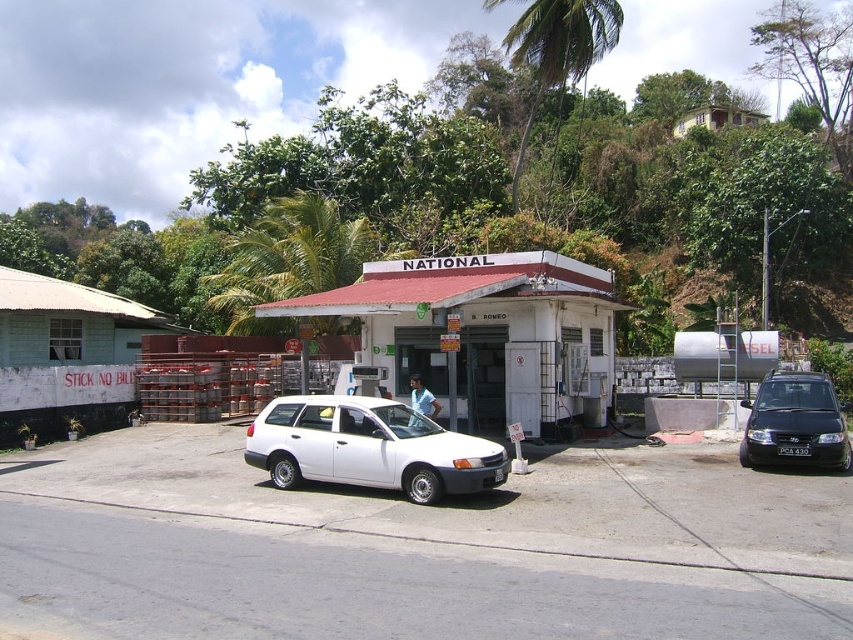
Does white matte wagon at center appear on the left side of black matte van at right?

Yes, white matte wagon at center is to the left of black matte van at right.

Can you confirm if white matte wagon at center is taller than black matte van at right?

In fact, white matte wagon at center may be shorter than black matte van at right.

Between point (447, 493) and point (831, 449), which one is positioned behind?

The point (831, 449) is more distant.

This screenshot has height=640, width=853. Find the location of `white matte wagon at center`. white matte wagon at center is located at coordinates (369, 448).